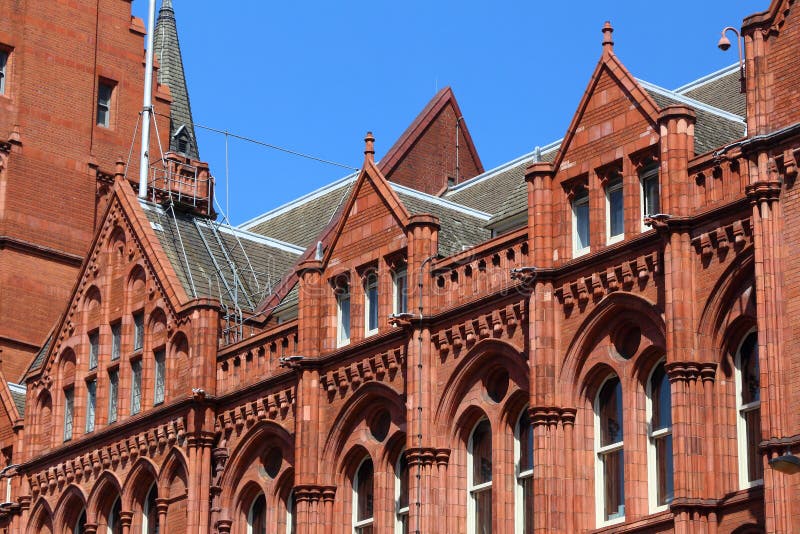
The height and width of the screenshot is (534, 800). I want to click on columns, so (692, 437), (553, 471), (421, 486), (309, 514), (198, 482).